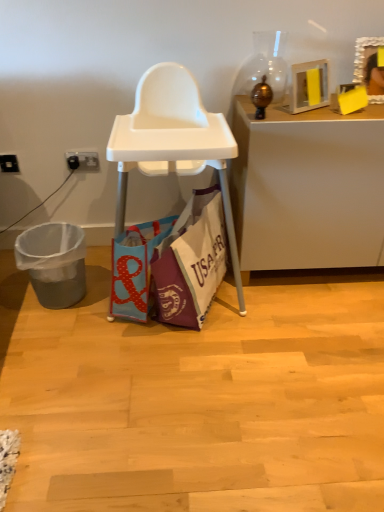
Identify the location of free space that is to the left of gray plastic trash can at lower left. (14, 298).